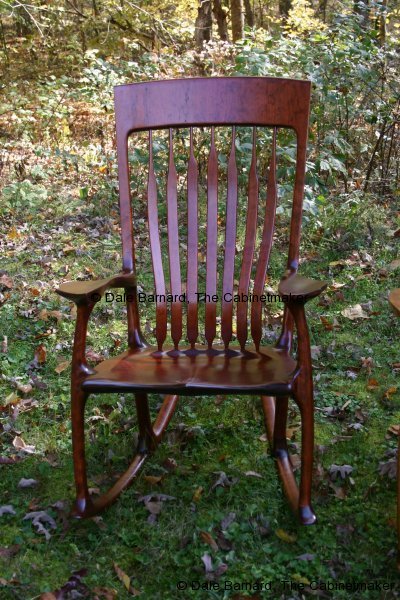
Locate an element on the screen. The width and height of the screenshot is (400, 600). center uprights on rocking chair back is located at coordinates (154, 224), (175, 233), (196, 250), (211, 242), (232, 232), (246, 237), (266, 243).